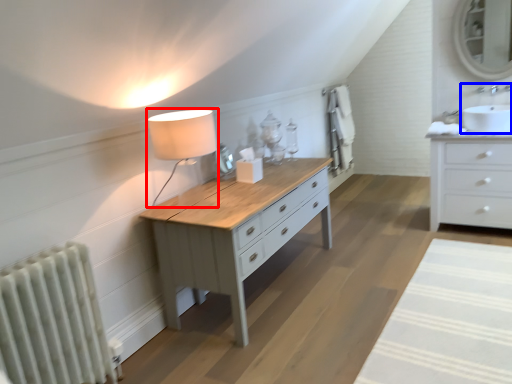
Question: Which point is further to the camera, table lamp (highlighted by a red box) or sink (highlighted by a blue box)?

Choices:
 (A) table lamp
 (B) sink

Answer: (B)